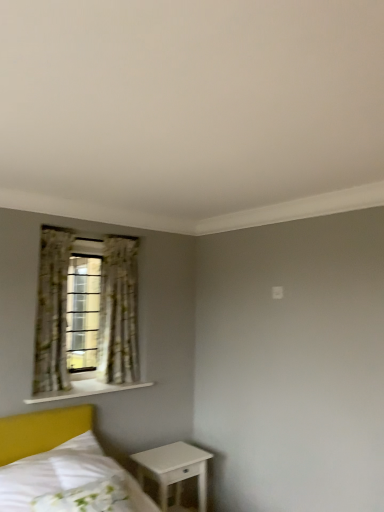
Question: From a real-world perspective, does white glossy nightstand at lower right stand above floral fabric curtain at left, marked as the 1th curtain in a left-to-right arrangement?

Choices:
 (A) no
 (B) yes

Answer: (A)

Question: Is white glossy nightstand at lower right taller than floral fabric curtain at left, the second curtain viewed from the right?

Choices:
 (A) no
 (B) yes

Answer: (A)

Question: Does white glossy nightstand at lower right have a lesser height compared to floral fabric curtain at left, marked as the 1th curtain in a left-to-right arrangement?

Choices:
 (A) yes
 (B) no

Answer: (A)

Question: Is the position of white glossy nightstand at lower right less distant than that of floral fabric curtain at left, the second curtain viewed from the right?

Choices:
 (A) yes
 (B) no

Answer: (A)

Question: Is white glossy nightstand at lower right surrounding floral fabric curtain at left, marked as the 1th curtain in a left-to-right arrangement?

Choices:
 (A) yes
 (B) no

Answer: (B)

Question: From a real-world perspective, is white glossy nightstand at lower right physically below floral fabric curtain at left, the second curtain viewed from the right?

Choices:
 (A) yes
 (B) no

Answer: (A)

Question: Is floral fabric curtain at left in contact with floral fabric curtain at left, marked as the 1th curtain in a left-to-right arrangement?

Choices:
 (A) no
 (B) yes

Answer: (A)

Question: Is floral fabric curtain at left in front of floral fabric curtain at left, the second curtain viewed from the right?

Choices:
 (A) no
 (B) yes

Answer: (B)

Question: Considering the relative sizes of floral fabric curtain at left and floral fabric curtain at left, the second curtain viewed from the right, in the image provided, is floral fabric curtain at left smaller than floral fabric curtain at left, the second curtain viewed from the right,?

Choices:
 (A) no
 (B) yes

Answer: (A)

Question: Does floral fabric curtain at left have a greater height compared to floral fabric curtain at left, marked as the 1th curtain in a left-to-right arrangement?

Choices:
 (A) yes
 (B) no

Answer: (A)

Question: From a real-world perspective, is floral fabric curtain at left positioned over floral fabric curtain at left, marked as the 1th curtain in a left-to-right arrangement, based on gravity?

Choices:
 (A) yes
 (B) no

Answer: (A)

Question: Is floral fabric curtain at left shorter than floral fabric curtain at left, the second curtain viewed from the right?

Choices:
 (A) no
 (B) yes

Answer: (A)

Question: From a real-world perspective, is white wooden shelf at lower left on floral fabric curtain at left, the first curtain viewed from the right?

Choices:
 (A) no
 (B) yes

Answer: (A)